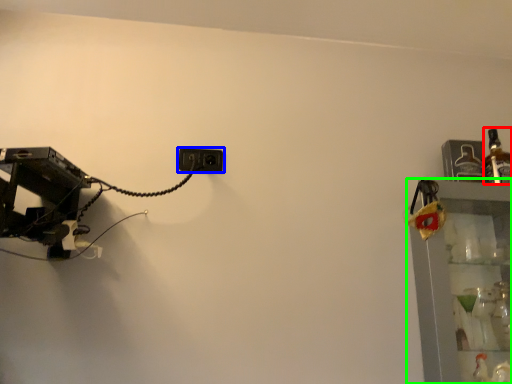
Question: Which object is the farthest from bottle (highlighted by a red box)? Choose among these: power plugs and sockets (highlighted by a blue box) or shelf (highlighted by a green box).

Choices:
 (A) power plugs and sockets
 (B) shelf

Answer: (A)